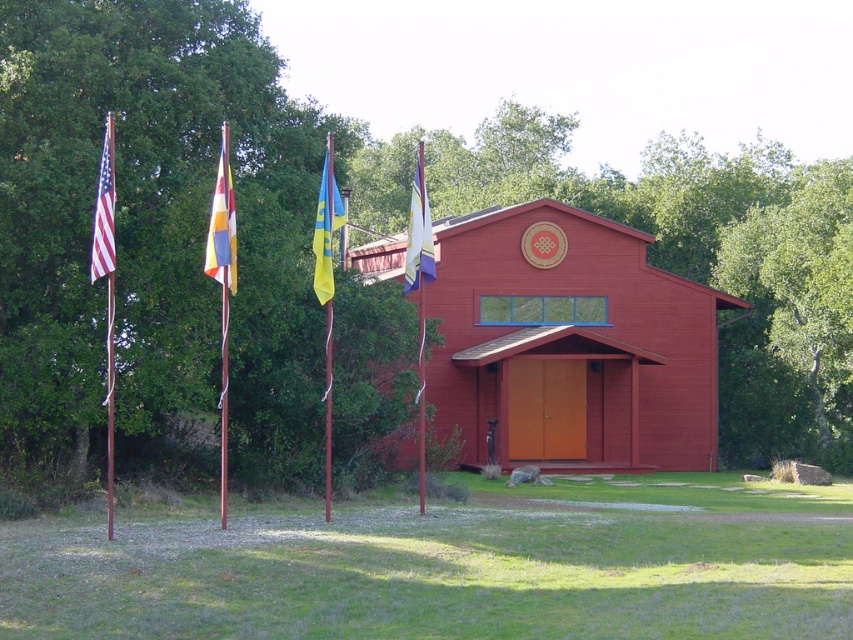
Looking at this image, how far apart are matte red chapel at center and multi-colored fabric flag at center?

A distance of 18.76 meters exists between matte red chapel at center and multi-colored fabric flag at center.

Is matte red chapel at center bigger than multi-colored fabric flag at center?

Correct, matte red chapel at center is larger in size than multi-colored fabric flag at center.

What do you see at coordinates (569, 344) in the screenshot? Image resolution: width=853 pixels, height=640 pixels. I see `matte red chapel at center` at bounding box center [569, 344].

Locate an element on the screen. matte red chapel at center is located at coordinates (569, 344).

Which is behind, point (234, 244) or point (224, 524)?

The point (234, 244) is behind.

Is multi-colored fabric flag at center bigger than wooden flag pole at left?

Indeed, multi-colored fabric flag at center has a larger size compared to wooden flag pole at left.

Where is `multi-colored fabric flag at center`? This screenshot has width=853, height=640. multi-colored fabric flag at center is located at coordinates (222, 224).

Identify the location of multi-colored fabric flag at center. This screenshot has width=853, height=640. [222, 224].

Which of these two, american flag at left or silky blue flag at center, stands taller?

Standing taller between the two is silky blue flag at center.

Between american flag at left and silky blue flag at center, which one appears on the left side from the viewer's perspective?

Positioned to the left is american flag at left.

Between point (99, 218) and point (407, 285), which one is positioned in front?

Point (99, 218) is in front.

You are a GUI agent. You are given a task and a screenshot of the screen. Output one action in this format:
    pyautogui.click(x=<x>, y=<y>)
    Task: Click on the american flag at left
    The width and height of the screenshot is (853, 640).
    Given the screenshot: What is the action you would take?
    pyautogui.click(x=103, y=209)